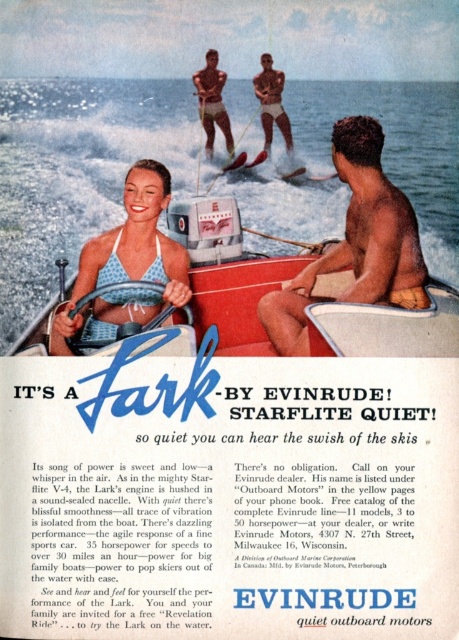
Which is more to the right, matte brown skin at center or smooth tan skin at center?

matte brown skin at center

Does matte brown skin at center appear on the right side of smooth tan skin at center?

Yes, matte brown skin at center is to the right of smooth tan skin at center.

Describe the element at coordinates (357, 243) in the screenshot. The image size is (459, 640). I see `matte brown skin at center` at that location.

Identify the location of matte brown skin at center. Image resolution: width=459 pixels, height=640 pixels. (357, 243).

Between smooth tan skin at center and smooth skin man at center, which one has less height?

smooth skin man at center

Does smooth tan skin at center appear over smooth skin man at center?

No.

Which is in front, point (214, 108) or point (263, 72)?

Point (263, 72) is in front.

At what (x,y) coordinates should I click in order to perform the action: click on smooth tan skin at center. Please return your answer as a coordinate pair (x, y). Looking at the image, I should click on (212, 102).

Who is taller, matte blue steering wheel at center or blue polka dot bikini at center?

matte blue steering wheel at center

Does point (268, 269) come closer to viewer compared to point (145, 264)?

No, it is not.

The width and height of the screenshot is (459, 640). Find the location of `matte blue steering wheel at center`. matte blue steering wheel at center is located at coordinates (384, 324).